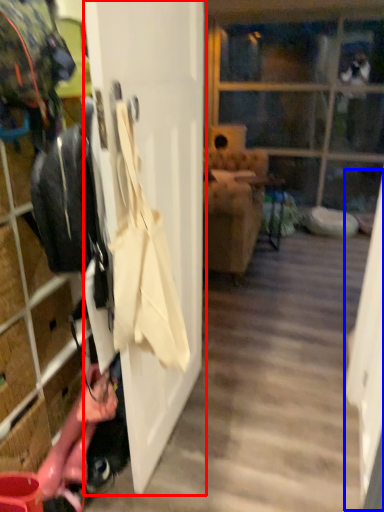
Question: Which object is closer to the camera taking this photo, door (highlighted by a red box) or screen door (highlighted by a blue box)?

Choices:
 (A) door
 (B) screen door

Answer: (A)